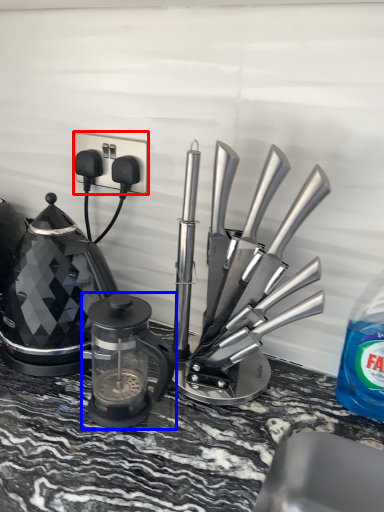
Question: Which object appears farthest to the camera in this image, electric outlet (highlighted by a red box) or kitchen appliance (highlighted by a blue box)?

Choices:
 (A) electric outlet
 (B) kitchen appliance

Answer: (A)